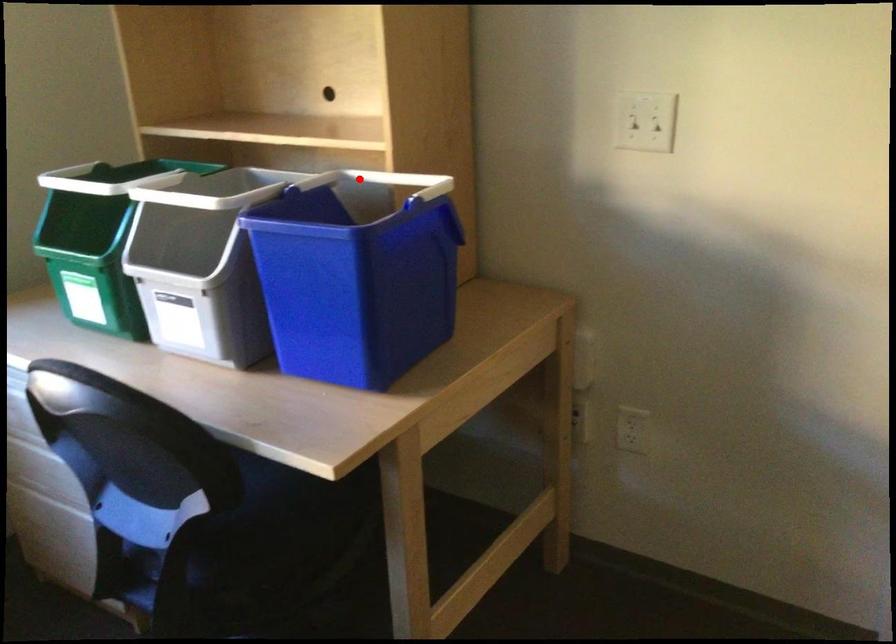
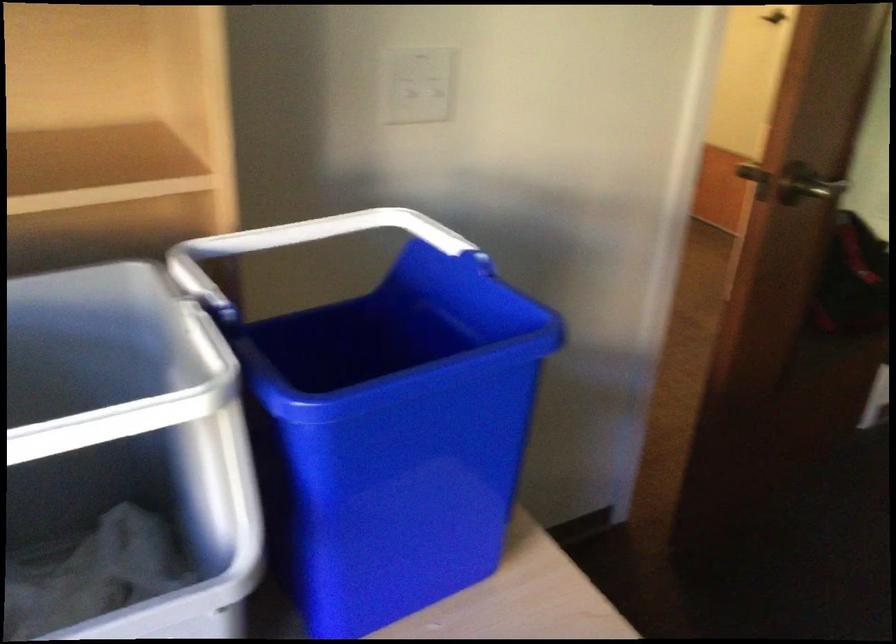
Locate, in the second image, the point that corresponds to the highlighted location in the first image.

(213, 257)